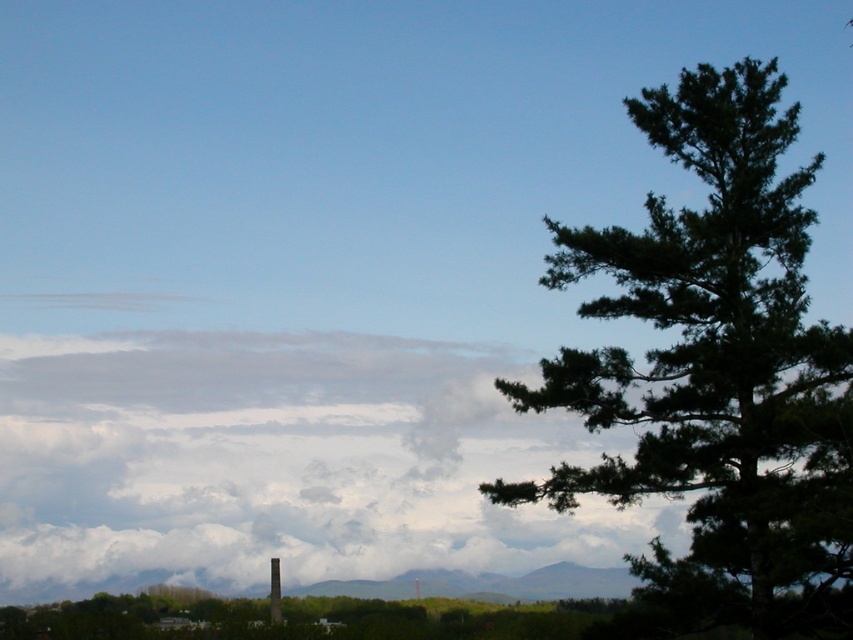
Which is in front, point (300, 442) or point (781, 291)?

Point (781, 291) is more forward.

Which is above, cloudy white cloud at upper left or dark green pine tree at right?

dark green pine tree at right is higher up.

Locate an element on the screen. This screenshot has height=640, width=853. cloudy white cloud at upper left is located at coordinates (277, 461).

Where is `cloudy white cloud at upper left`? Image resolution: width=853 pixels, height=640 pixels. cloudy white cloud at upper left is located at coordinates (277, 461).